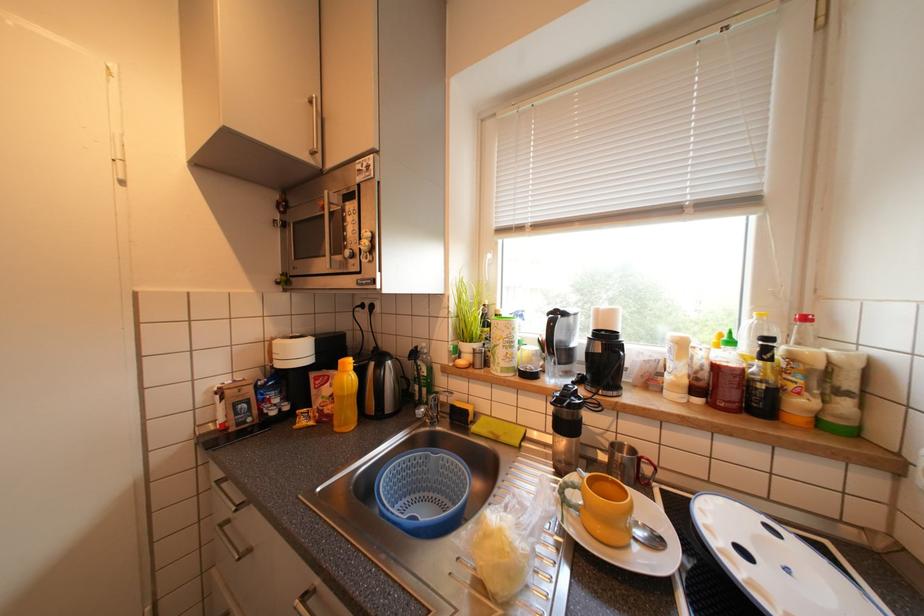
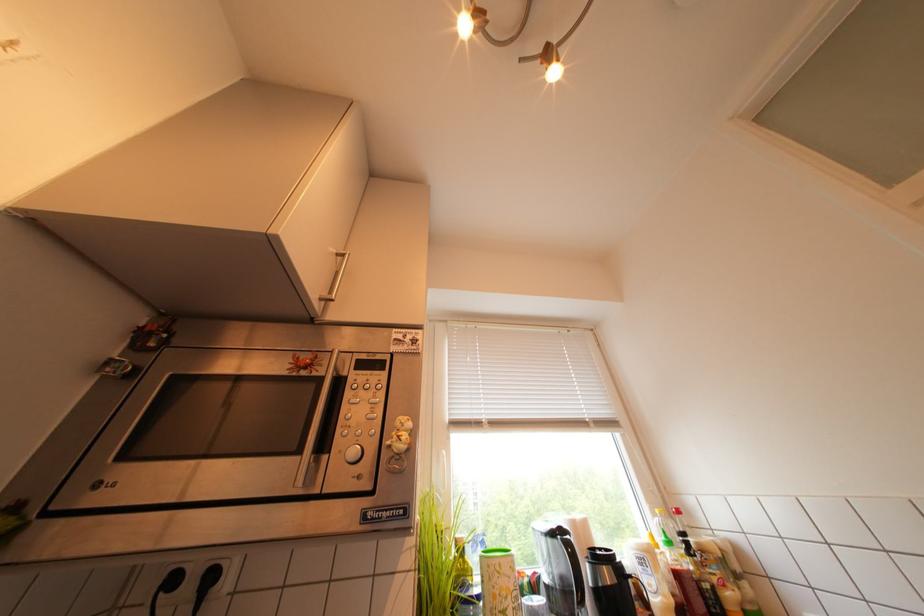
The images are taken continuously from a first-person perspective. In which direction is your viewpoint rotating?

The camera's rotation is toward right-up.